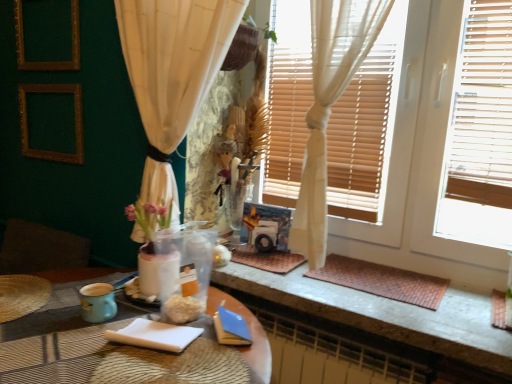
The width and height of the screenshot is (512, 384). What are the coordinates of `vacant space positioned to the left of white paper notepad at lower center` in the screenshot? It's located at (78, 340).